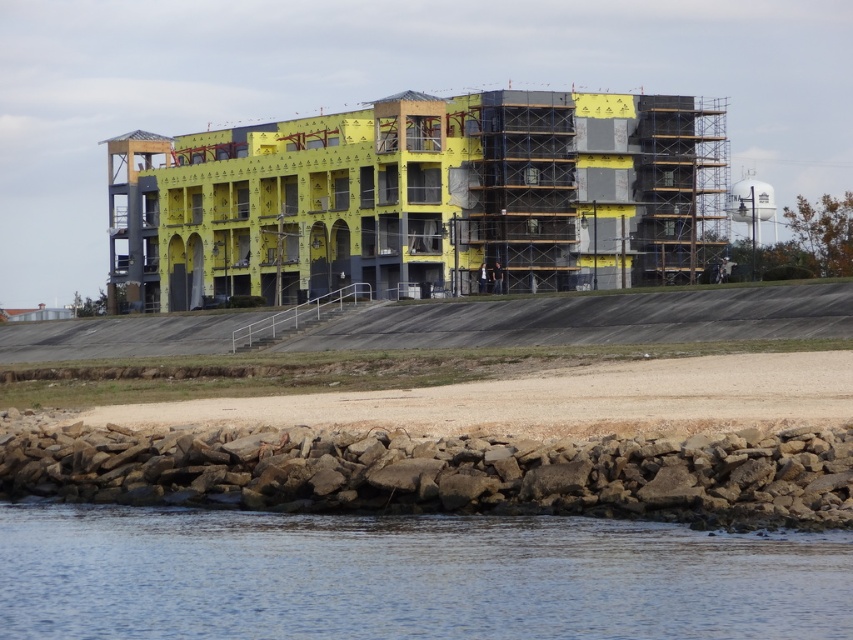
Question: Which point is farther from the camera taking this photo?

Choices:
 (A) (381, 256)
 (B) (352, 612)

Answer: (A)

Question: Can you confirm if yellow foam insulation at center is bigger than clear water at lower center?

Choices:
 (A) yes
 (B) no

Answer: (A)

Question: Does yellow foam insulation at center have a greater width compared to clear water at lower center?

Choices:
 (A) yes
 (B) no

Answer: (A)

Question: Among these objects, which one is nearest to the camera?

Choices:
 (A) yellow foam insulation at center
 (B) clear water at lower center

Answer: (B)

Question: Which object appears closest to the camera in this image?

Choices:
 (A) yellow foam insulation at center
 (B) clear water at lower center

Answer: (B)

Question: From the image, what is the correct spatial relationship of yellow foam insulation at center in relation to clear water at lower center?

Choices:
 (A) left
 (B) right

Answer: (B)